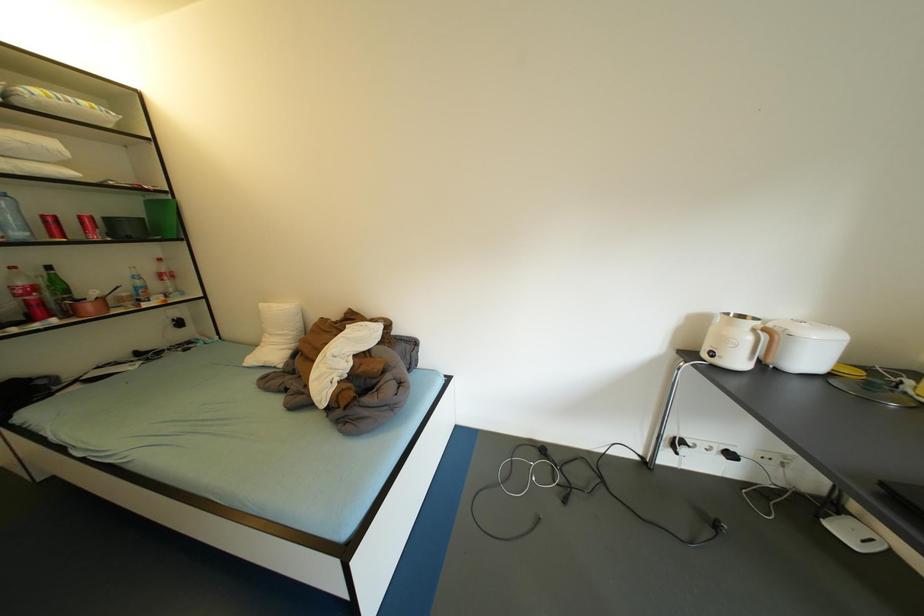
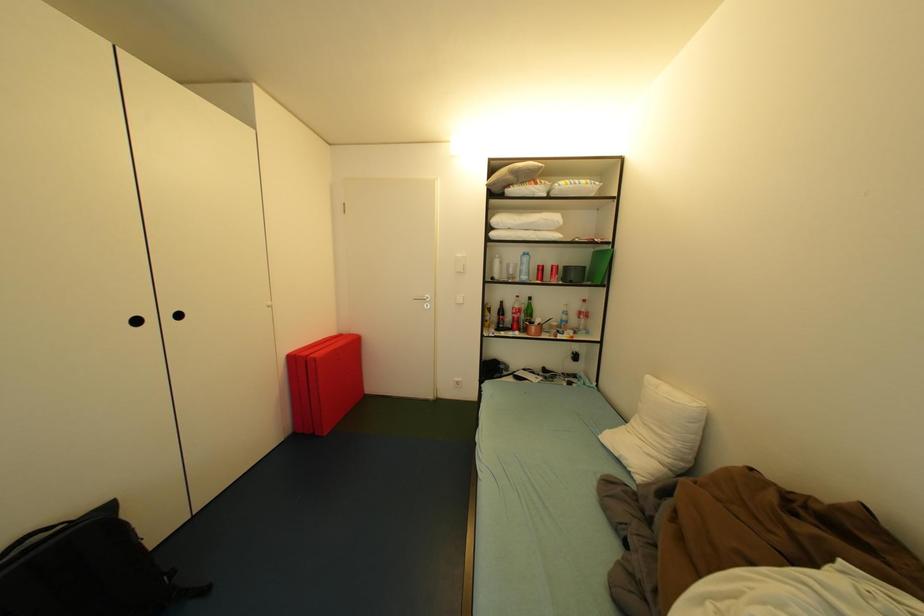
Question: The camera is either moving clockwise (left) or counter-clockwise (right) around the object. The first image is from the beginning of the video and the second image is from the end. Is the camera moving left or right when shooting the video?

Choices:
 (A) Left
 (B) Right

Answer: (B)